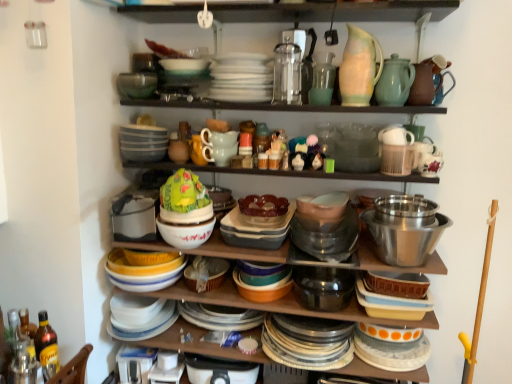
Question: Is point click(314, 61) closer or farther from the camera than point click(147, 72)?

Choices:
 (A) closer
 (B) farther

Answer: (B)

Question: From a real-world perspective, relative to green glass bowl at upper center, positioned as the 1th bowl in top-to-bottom order, is matte glass vase at upper center, which is the fourth tableware from right to left, vertically above or below?

Choices:
 (A) below
 (B) above

Answer: (B)

Question: Which of these objects is positioned closest to the green glass bowl at upper center, positioned as the 1th bowl in top-to-bottom order?

Choices:
 (A) matte ceramic bowl at center, marked as the 4th bowl in a top-to-bottom arrangement
 (B) translucent amber glass bottle at lower left
 (C) green matte pitcher at upper right, which is the 4th tableware from left to right
 (D) matte white bowl at center
 (E) matte ceramic bowls at center

Answer: (D)

Question: Estimate the real-world distances between objects in this image. Which object is farther from the matte ceramic bowl at center, the 3th bowl positioned from the left?

Choices:
 (A) green matte cake at center, which is the second food from right to left
 (B) matte glass vase at upper center, which is the fourth tableware from right to left
 (C) translucent glass bowl at center, arranged as the 2th food when viewed from the left
 (D) green glass bowl at upper center, positioned as the 1th bowl in top-to-bottom order
 (E) translucent amber glass bottle at lower left

Answer: (B)